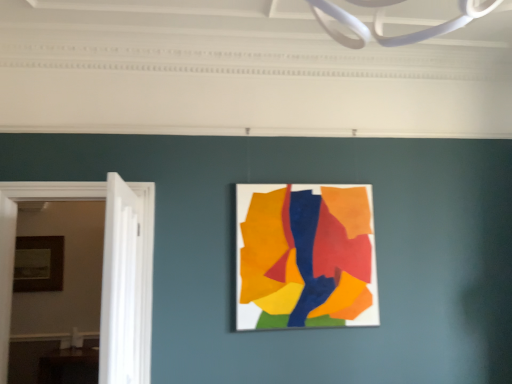
Question: From a real-world perspective, is matte paper collage at center, marked as the second picture frame in a back-to-front arrangement, below wooden picture frame at left, which ranks as the second picture frame in front-to-back order?

Choices:
 (A) yes
 (B) no

Answer: (B)

Question: Does matte paper collage at center, marked as the second picture frame in a back-to-front arrangement, have a greater height compared to wooden picture frame at left, which ranks as the second picture frame in front-to-back order?

Choices:
 (A) yes
 (B) no

Answer: (A)

Question: Is matte paper collage at center, which is the first picture frame from front to back, positioned far away from wooden picture frame at left, arranged as the 1th picture frame when viewed from the back?

Choices:
 (A) no
 (B) yes

Answer: (B)

Question: Is matte paper collage at center, marked as the second picture frame in a back-to-front arrangement, not within wooden picture frame at left, placed as the 1th picture frame when sorted from left to right?

Choices:
 (A) yes
 (B) no

Answer: (A)

Question: Does matte paper collage at center, which is the first picture frame from front to back, have a larger size compared to wooden picture frame at left, arranged as the second picture frame when viewed from the right?

Choices:
 (A) yes
 (B) no

Answer: (A)

Question: From the image's perspective, is white wooden door at left located above or below wooden picture frame at left, which ranks as the second picture frame in front-to-back order?

Choices:
 (A) above
 (B) below

Answer: (A)

Question: In the image, is white wooden door at left positioned in front of or behind wooden picture frame at left, arranged as the 1th picture frame when viewed from the back?

Choices:
 (A) front
 (B) behind

Answer: (A)

Question: Considering the positions of white wooden door at left and wooden picture frame at left, arranged as the second picture frame when viewed from the right, in the image, is white wooden door at left bigger or smaller than wooden picture frame at left, arranged as the second picture frame when viewed from the right,?

Choices:
 (A) small
 (B) big

Answer: (B)

Question: Considering the relative positions of white wooden door at left and wooden picture frame at left, arranged as the 1th picture frame when viewed from the back, in the image provided, is white wooden door at left to the left or to the right of wooden picture frame at left, arranged as the 1th picture frame when viewed from the back,?

Choices:
 (A) right
 (B) left

Answer: (A)

Question: From the image's perspective, relative to matte paper collage at center, which is the 2th picture frame in left-to-right order, is white wooden door at left above or below?

Choices:
 (A) above
 (B) below

Answer: (B)

Question: Is point pos(126,362) closer or farther from the camera than point pos(358,322)?

Choices:
 (A) farther
 (B) closer

Answer: (B)

Question: In the image, is white wooden door at left on the left side or the right side of matte paper collage at center, which is the 2th picture frame in left-to-right order?

Choices:
 (A) right
 (B) left

Answer: (B)

Question: In terms of height, does white wooden door at left look taller or shorter compared to matte paper collage at center, marked as the second picture frame in a back-to-front arrangement?

Choices:
 (A) tall
 (B) short

Answer: (A)

Question: From the image's perspective, is matte paper collage at center, marked as the second picture frame in a back-to-front arrangement, located above or below wooden picture frame at left, placed as the 1th picture frame when sorted from left to right?

Choices:
 (A) above
 (B) below

Answer: (A)

Question: Considering the positions of matte paper collage at center, marked as the 1th picture frame in a right-to-left arrangement, and wooden picture frame at left, which ranks as the second picture frame in front-to-back order, in the image, is matte paper collage at center, marked as the 1th picture frame in a right-to-left arrangement, bigger or smaller than wooden picture frame at left, which ranks as the second picture frame in front-to-back order,?

Choices:
 (A) big
 (B) small

Answer: (A)